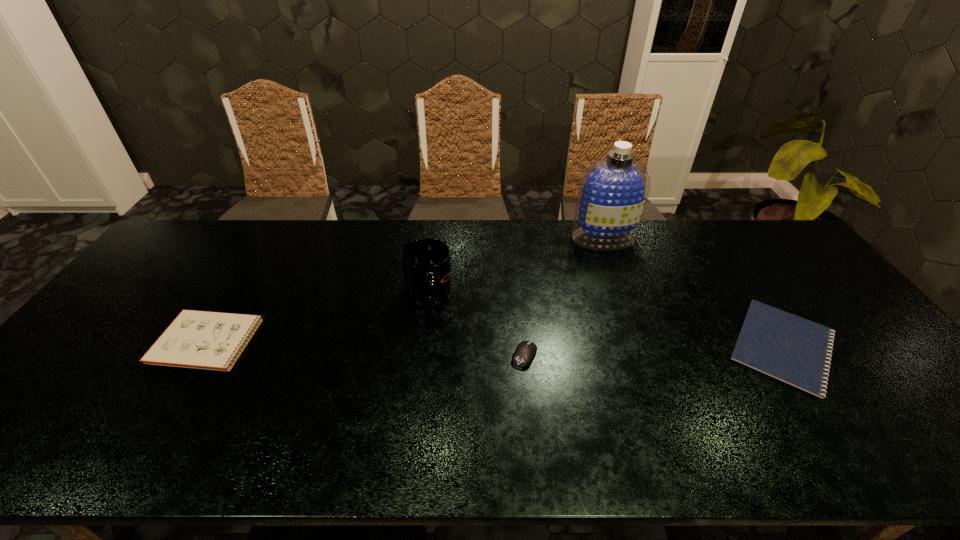
What are the coordinates of `blank area in the image that satisfies the following two spatial constraints: 1. with the handle on the side of the mug; 2. on the left side of the shorter notepad` in the screenshot? It's located at (422, 346).

Where is `free location that satisfies the following two spatial constraints: 1. on the front side of the rightmost object; 2. on the left side of the farthest object`? The width and height of the screenshot is (960, 540). free location that satisfies the following two spatial constraints: 1. on the front side of the rightmost object; 2. on the left side of the farthest object is located at coordinates (641, 346).

You are a GUI agent. You are given a task and a screenshot of the screen. Output one action in this format:
    pyautogui.click(x=<x>, y=<y>)
    Task: Click on the vacant area that satisfies the following two spatial constraints: 1. with the handle on the side of the shorter notepad; 2. on the left side of the mug
    The height and width of the screenshot is (540, 960).
    Given the screenshot: What is the action you would take?
    pyautogui.click(x=422, y=346)

The height and width of the screenshot is (540, 960). Find the location of `vacant space that satisfies the following two spatial constraints: 1. with the handle on the side of the second tallest object; 2. on the right side of the computer equipment`. vacant space that satisfies the following two spatial constraints: 1. with the handle on the side of the second tallest object; 2. on the right side of the computer equipment is located at coordinates (421, 355).

This screenshot has width=960, height=540. Identify the location of free spot that satisfies the following two spatial constraints: 1. with the handle on the side of the rightmost object; 2. on the right side of the fourth shortest object. (422, 346).